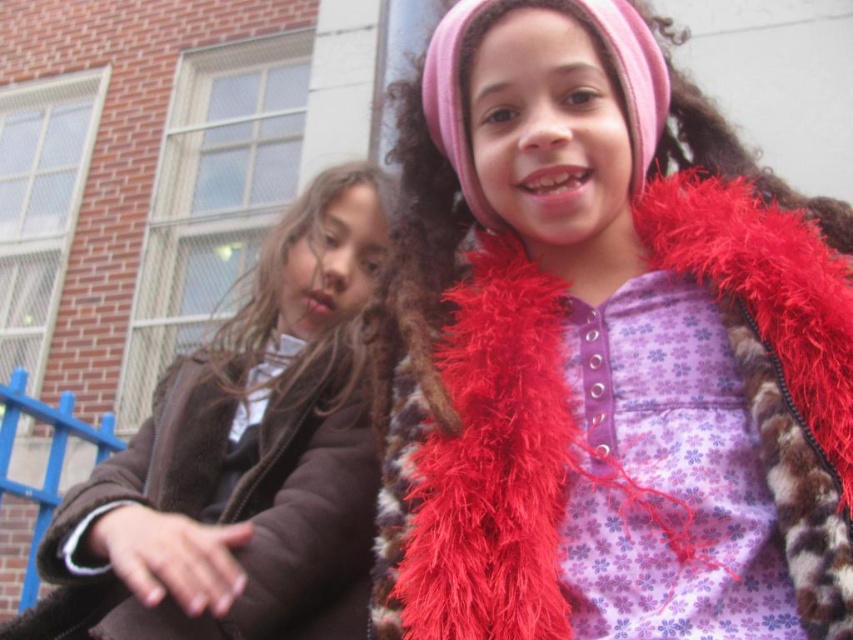
Question: Among these points, which one is nearest to the camera?

Choices:
 (A) click(x=494, y=564)
 (B) click(x=196, y=464)

Answer: (A)

Question: Does fuzzy red scarf at upper right lie behind brown fuzzy coat at left?

Choices:
 (A) no
 (B) yes

Answer: (A)

Question: Is fuzzy red scarf at upper right further to the viewer compared to brown fuzzy coat at left?

Choices:
 (A) yes
 (B) no

Answer: (B)

Question: Can you confirm if fuzzy red scarf at upper right is wider than brown fuzzy coat at left?

Choices:
 (A) no
 (B) yes

Answer: (B)